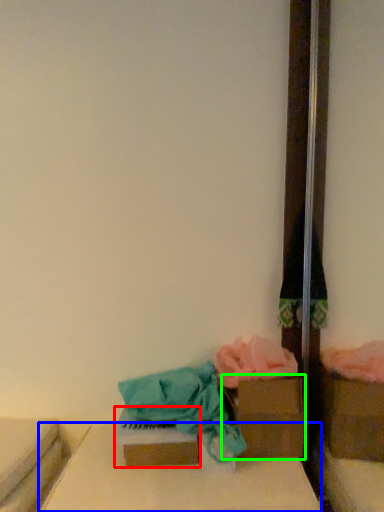
Question: Which object is positioned closest to storage box (highlighted by a red box)? Select from furniture (highlighted by a blue box) and storage box (highlighted by a green box).

Choices:
 (A) furniture
 (B) storage box

Answer: (A)